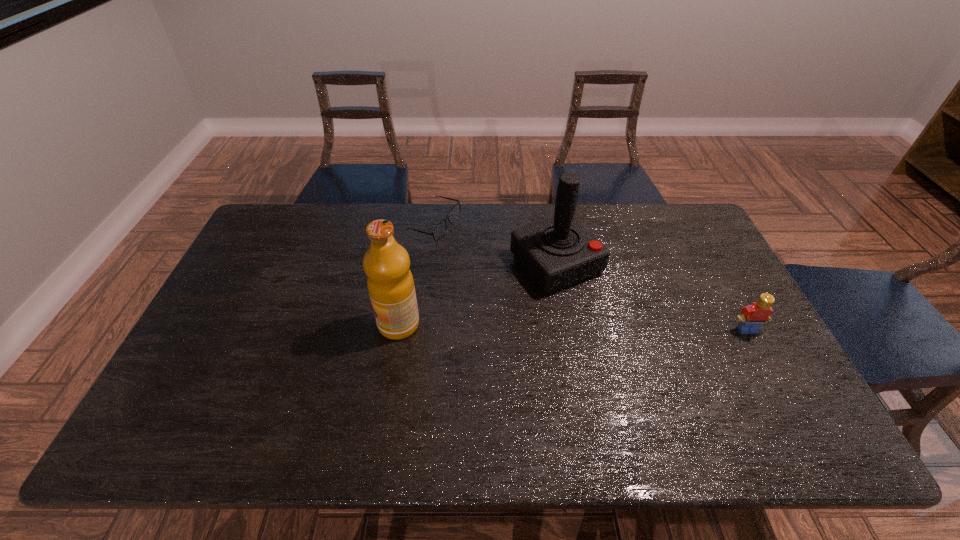
In order to click on free space located with the lenses facing outward on the spectacles in this screenshot , I will do `click(475, 270)`.

Find the location of `vacant area located 0.260m with the lenses facing outward on the spectacles`. vacant area located 0.260m with the lenses facing outward on the spectacles is located at coordinates (492, 287).

I want to click on vacant area situated on the base of the second object from right to left, so [620, 334].

Find the location of a particular element. This screenshot has height=540, width=960. free space located on the base of the second object from right to left is located at coordinates (643, 359).

This screenshot has height=540, width=960. In order to click on blank area located on the base of the second object from right to left in this screenshot , I will do `click(645, 362)`.

You are a GUI agent. You are given a task and a screenshot of the screen. Output one action in this format:
    pyautogui.click(x=<x>, y=<y>)
    Task: Click on the spectacles located in the far edge section of the desktop
    This screenshot has height=540, width=960.
    Given the screenshot: What is the action you would take?
    pyautogui.click(x=440, y=229)

Image resolution: width=960 pixels, height=540 pixels. What are the coordinates of `joystick present at the far edge` in the screenshot? It's located at (557, 252).

Find the location of a particular element. object that is at the right edge is located at coordinates (752, 316).

This screenshot has height=540, width=960. I want to click on vacant area at the far edge of the desktop, so click(511, 215).

The height and width of the screenshot is (540, 960). Find the location of `vacant point at the near edge`. vacant point at the near edge is located at coordinates (515, 403).